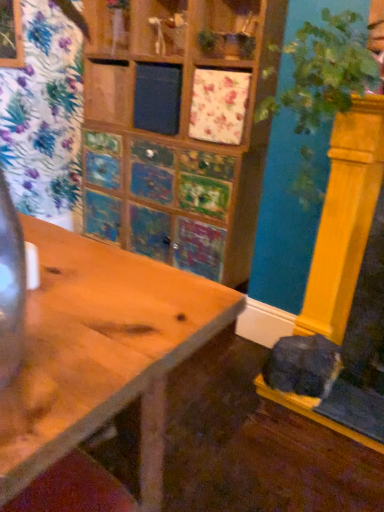
Question: Is green leafy plant at right in front of soft gray fur cat at lower right?

Choices:
 (A) no
 (B) yes

Answer: (B)

Question: Does green leafy plant at right have a larger size compared to soft gray fur cat at lower right?

Choices:
 (A) yes
 (B) no

Answer: (A)

Question: Is green leafy plant at right positioned beyond the bounds of soft gray fur cat at lower right?

Choices:
 (A) yes
 (B) no

Answer: (A)

Question: Does green leafy plant at right turn towards soft gray fur cat at lower right?

Choices:
 (A) yes
 (B) no

Answer: (B)

Question: From the image's perspective, is green leafy plant at right on soft gray fur cat at lower right?

Choices:
 (A) yes
 (B) no

Answer: (A)

Question: Is green leafy plant at right wider than soft gray fur cat at lower right?

Choices:
 (A) yes
 (B) no

Answer: (A)

Question: Is the surface of soft gray fur cat at lower right in direct contact with green leafy plant at right?

Choices:
 (A) yes
 (B) no

Answer: (B)

Question: Could you tell me if soft gray fur cat at lower right is turned towards green leafy plant at right?

Choices:
 (A) no
 (B) yes

Answer: (A)

Question: Considering the relative sizes of soft gray fur cat at lower right and green leafy plant at right in the image provided, is soft gray fur cat at lower right taller than green leafy plant at right?

Choices:
 (A) yes
 (B) no

Answer: (B)

Question: From a real-world perspective, is soft gray fur cat at lower right over green leafy plant at right?

Choices:
 (A) no
 (B) yes

Answer: (A)

Question: Can you confirm if soft gray fur cat at lower right is smaller than green leafy plant at right?

Choices:
 (A) no
 (B) yes

Answer: (B)

Question: Can you confirm if soft gray fur cat at lower right is positioned to the right of green leafy plant at right?

Choices:
 (A) no
 (B) yes

Answer: (B)

Question: Is soft gray fur cat at lower right turned away from wooden table at center?

Choices:
 (A) yes
 (B) no

Answer: (B)